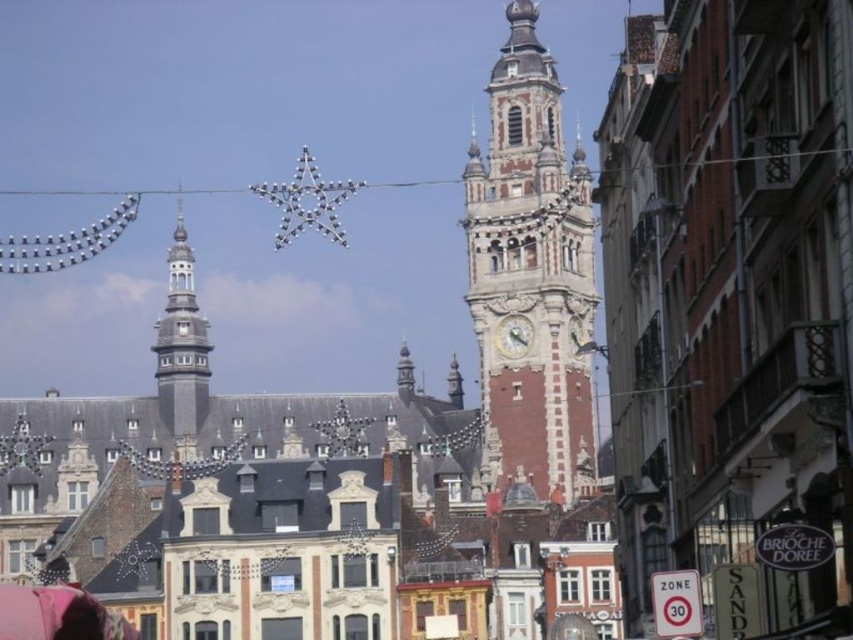
Question: Observing the image, what is the correct spatial positioning of red brick clock tower at center in reference to gray stone bell tower at left?

Choices:
 (A) left
 (B) right

Answer: (B)

Question: In this image, where is red brick clock tower at center located relative to gray stone bell tower at left?

Choices:
 (A) above
 (B) below

Answer: (A)

Question: Does red brick clock tower at center appear under gray stone bell tower at left?

Choices:
 (A) no
 (B) yes

Answer: (A)

Question: Among these points, which one is farthest from the camera?

Choices:
 (A) (535, 227)
 (B) (207, 364)

Answer: (B)

Question: Which point is farther to the camera?

Choices:
 (A) (550, 404)
 (B) (158, 337)

Answer: (B)